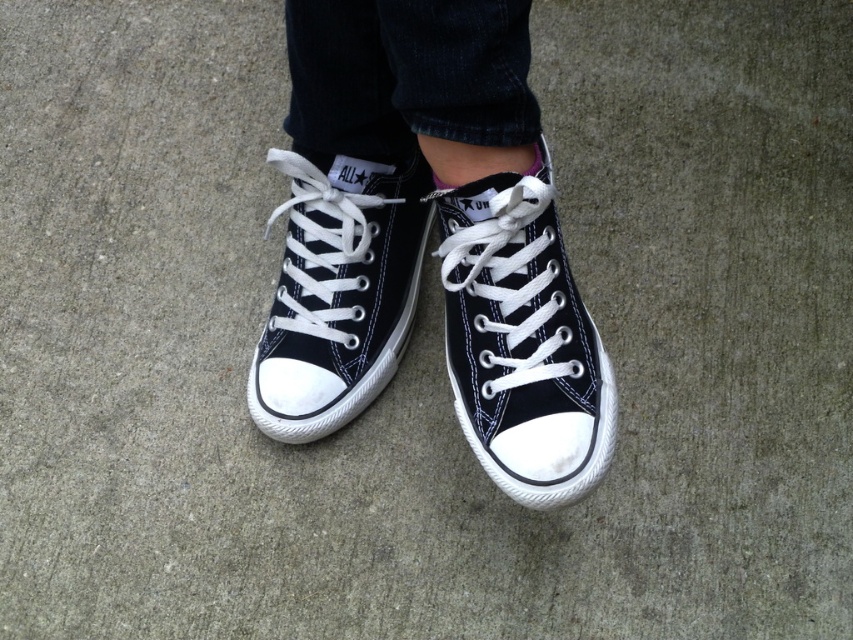
What object is located at the coordinates point (521, 339)?

The black canvas shoe at center is located at point (521, 339).

You are a photographer setting up a shot of the black canvas shoe at center. If your camera can focus on objects within 1.2 meters, will it be able to capture the shoe clearly?

The black canvas shoe at center is 1.18 meters away from the camera, which is within the 1.2 meter focus range. Therefore, the camera can capture the shoe clearly.

Looking at this image, you are standing in front of the black canvas sneakers at center. If you move 0.1 units to the right along the x axis, will you be closer to the sneakers?

The black canvas sneakers at center is located at point (425, 237). Moving 0.1 units to the right along the x axis would increase your distance from the sneakers since you are moving away from their x coordinate of 0.373. Therefore, you will be farther from the sneakers.